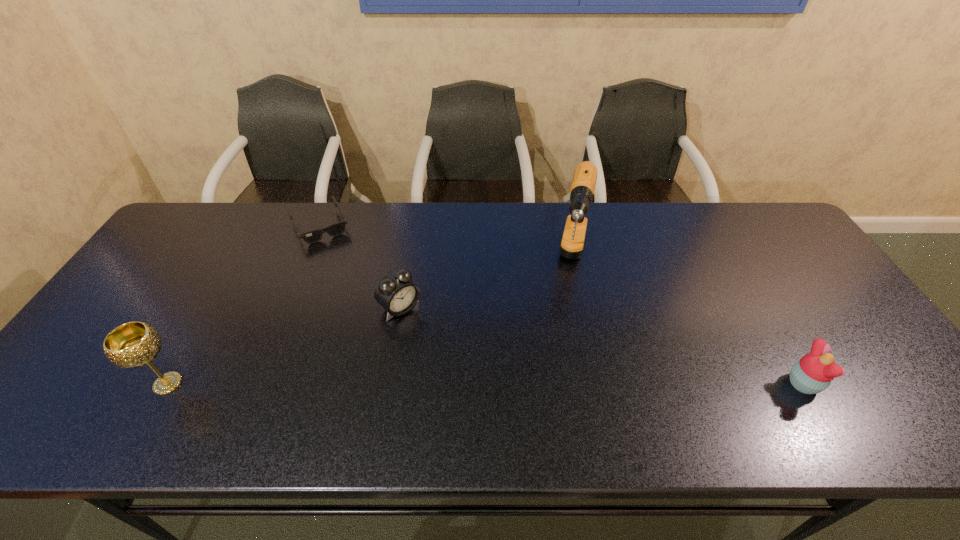
The height and width of the screenshot is (540, 960). What are the coordinates of `drill present at the far edge` in the screenshot? It's located at [x=583, y=185].

Find the location of `chalice that is at the near edge`. chalice that is at the near edge is located at coordinates (134, 344).

I want to click on cupcake positioned at the near edge, so click(x=813, y=373).

This screenshot has width=960, height=540. I want to click on vacant point at the far edge, so click(x=320, y=219).

In order to click on free region at the near edge in this screenshot , I will do `click(136, 381)`.

This screenshot has width=960, height=540. I want to click on vacant space at the right edge of the desktop, so point(868,350).

Image resolution: width=960 pixels, height=540 pixels. In order to click on vacant space at the far left corner of the desktop in this screenshot , I will do `click(191, 232)`.

Image resolution: width=960 pixels, height=540 pixels. In the image, there is a desktop. In order to click on vacant space at the near left corner in this screenshot , I will do `click(76, 374)`.

You are a GUI agent. You are given a task and a screenshot of the screen. Output one action in this format:
    pyautogui.click(x=<x>, y=<y>)
    Task: Click on the vacant point located between the rightmost object and the fourth object from right to left
    This screenshot has width=960, height=540.
    Given the screenshot: What is the action you would take?
    pyautogui.click(x=562, y=305)

You are a GUI agent. You are given a task and a screenshot of the screen. Output one action in this format:
    pyautogui.click(x=<x>, y=<y>)
    Task: Click on the unoccupied area between the cupcake and the second tallest object
    The height and width of the screenshot is (540, 960).
    Given the screenshot: What is the action you would take?
    pyautogui.click(x=486, y=384)